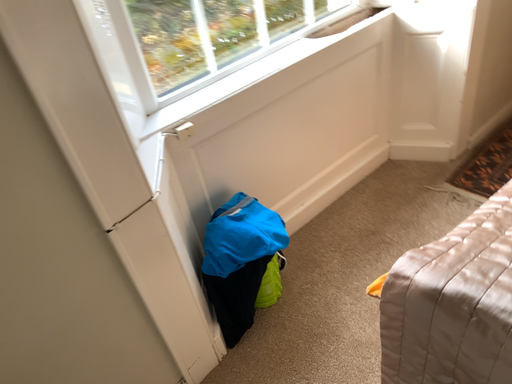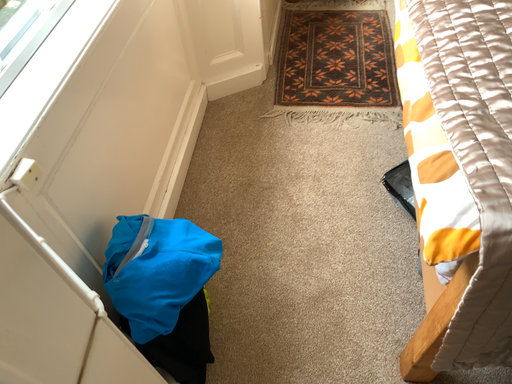
Question: Which way did the camera rotate in the video?

Choices:
 (A) rotated right
 (B) rotated left

Answer: (A)